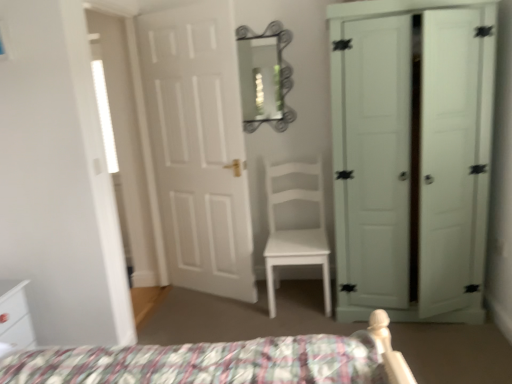
Question: Is white glossy nightstand at lower left outside of metallic silver mirror at upper center?

Choices:
 (A) no
 (B) yes

Answer: (B)

Question: Does white glossy nightstand at lower left have a lesser width compared to metallic silver mirror at upper center?

Choices:
 (A) yes
 (B) no

Answer: (B)

Question: Is white glossy nightstand at lower left taller than metallic silver mirror at upper center?

Choices:
 (A) no
 (B) yes

Answer: (A)

Question: Is white glossy nightstand at lower left far from metallic silver mirror at upper center?

Choices:
 (A) no
 (B) yes

Answer: (B)

Question: Is metallic silver mirror at upper center completely or partially inside white glossy nightstand at lower left?

Choices:
 (A) yes
 (B) no

Answer: (B)

Question: Do you think metallic silver mirror at upper center is within white matte chair at center, or outside of it?

Choices:
 (A) inside
 (B) outside

Answer: (B)

Question: In the image, is metallic silver mirror at upper center positioned in front of or behind white matte chair at center?

Choices:
 (A) front
 (B) behind

Answer: (B)

Question: In terms of size, does metallic silver mirror at upper center appear bigger or smaller than white matte chair at center?

Choices:
 (A) small
 (B) big

Answer: (A)

Question: In terms of height, does metallic silver mirror at upper center look taller or shorter compared to white matte chair at center?

Choices:
 (A) short
 (B) tall

Answer: (A)

Question: From the image's perspective, is white matte door at right, which is the second door from left to right, above or below white matte chair at center?

Choices:
 (A) above
 (B) below

Answer: (A)

Question: In the image, is white matte door at right, marked as the first door in a right-to-left arrangement, on the left side or the right side of white matte chair at center?

Choices:
 (A) left
 (B) right

Answer: (B)

Question: Is white matte door at right, marked as the first door in a right-to-left arrangement, wider or thinner than white matte chair at center?

Choices:
 (A) thin
 (B) wide

Answer: (B)

Question: From a real-world perspective, relative to white matte chair at center, is white matte door at right, marked as the first door in a right-to-left arrangement, vertically above or below?

Choices:
 (A) below
 (B) above

Answer: (B)

Question: From the image's perspective, is white glossy nightstand at lower left positioned above or below white matte chair at center?

Choices:
 (A) above
 (B) below

Answer: (B)

Question: Considering the positions of white glossy nightstand at lower left and white matte chair at center in the image, is white glossy nightstand at lower left wider or thinner than white matte chair at center?

Choices:
 (A) thin
 (B) wide

Answer: (A)